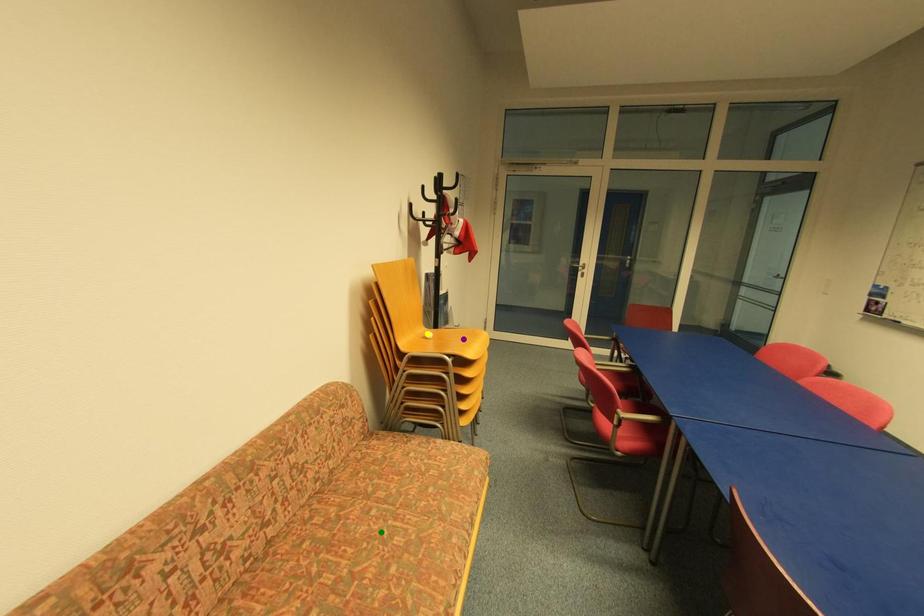
Order these from nearest to farthest:
yellow point | green point | purple point

green point → yellow point → purple point